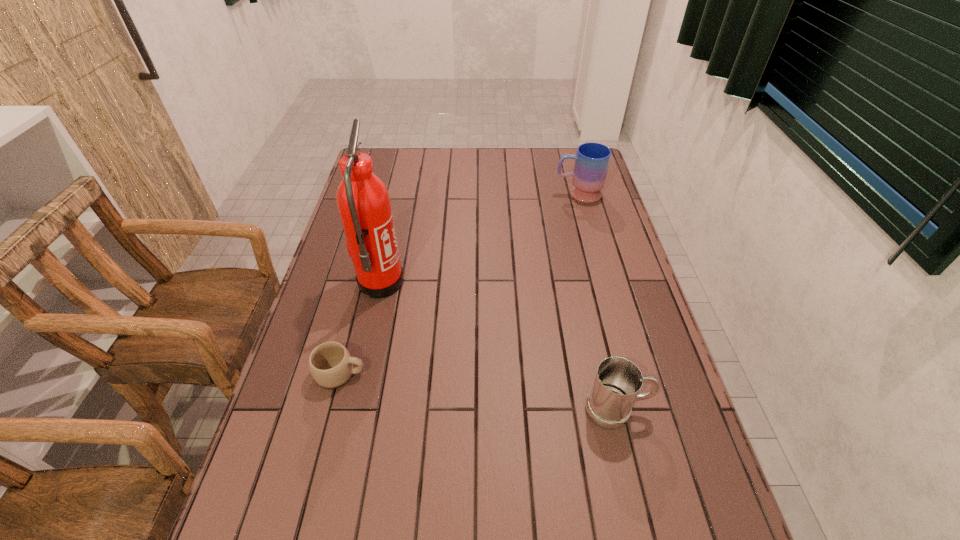
The width and height of the screenshot is (960, 540). Identify the location of the tallest object. (363, 201).

Image resolution: width=960 pixels, height=540 pixels. Find the location of `the second farthest object`. the second farthest object is located at coordinates (363, 201).

Where is `the tallest mug`? This screenshot has width=960, height=540. the tallest mug is located at coordinates (592, 160).

Identify the location of the farthest mug. (592, 160).

The width and height of the screenshot is (960, 540). In order to click on the second shortest mug in this screenshot , I will do `click(617, 382)`.

Where is `the shortest mug`? This screenshot has width=960, height=540. the shortest mug is located at coordinates (330, 363).

Find the location of a particular element. The image size is (960, 540). the shortest object is located at coordinates (330, 363).

Locate an element on the screen. This screenshot has height=540, width=960. free location located 0.400m on the label side of the fire extinguisher is located at coordinates (540, 284).

This screenshot has width=960, height=540. I want to click on vacant space situated on the side of the tallest mug with the handle, so click(x=462, y=194).

In order to click on free space located on the side of the tallest mug with the handle in this screenshot , I will do `click(508, 194)`.